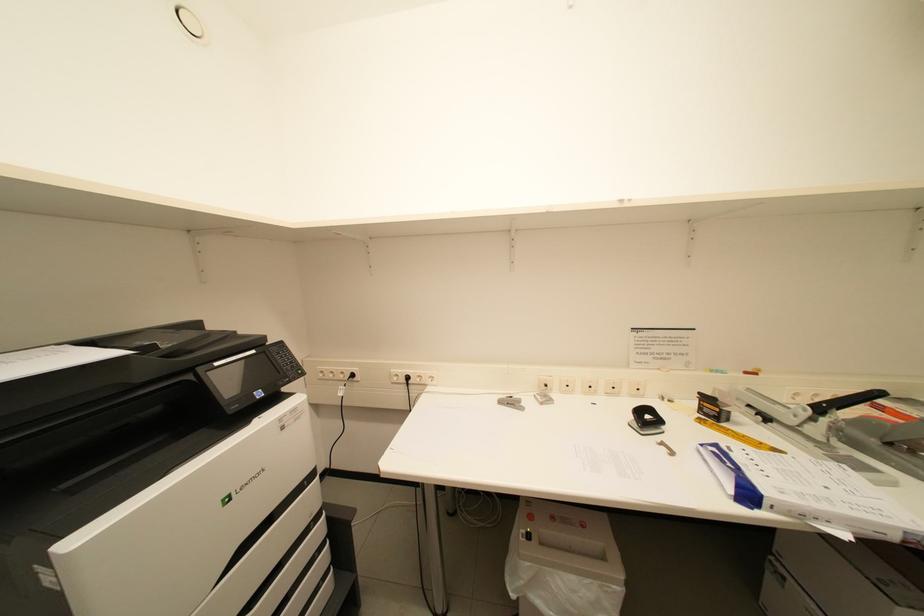
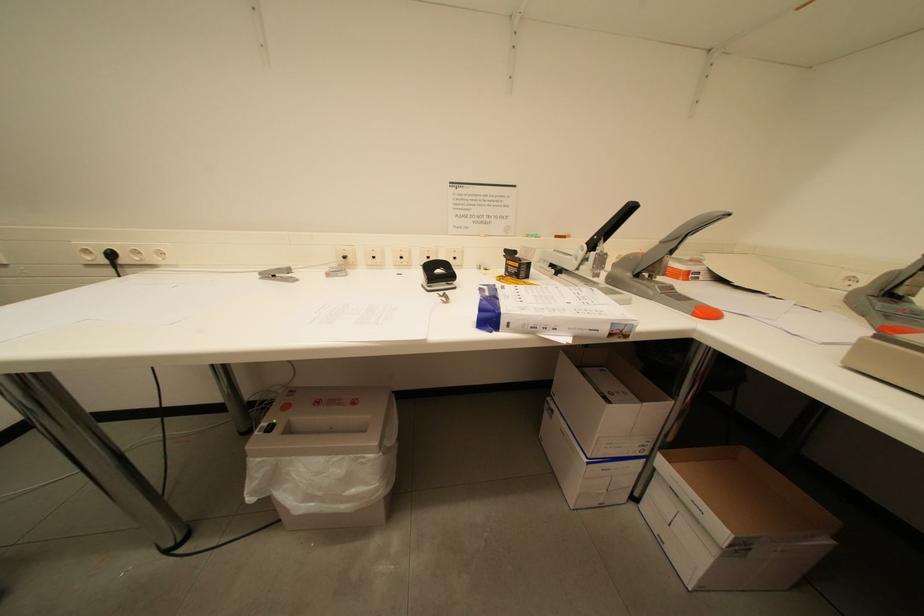
From the picture: What movement of the cameraman would produce the second image?

The cameraman walked toward right, forward.